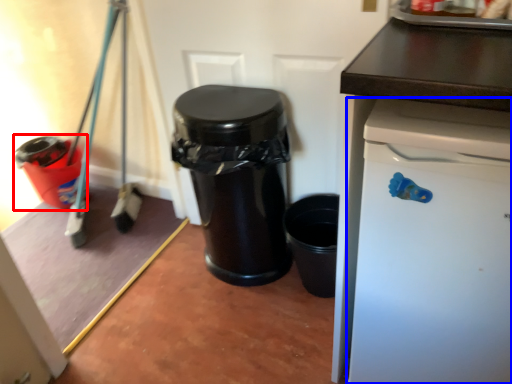
Question: Which object appears farthest to the camera in this image, waste container (highlighted by a red box) or dish washer (highlighted by a blue box)?

Choices:
 (A) waste container
 (B) dish washer

Answer: (A)